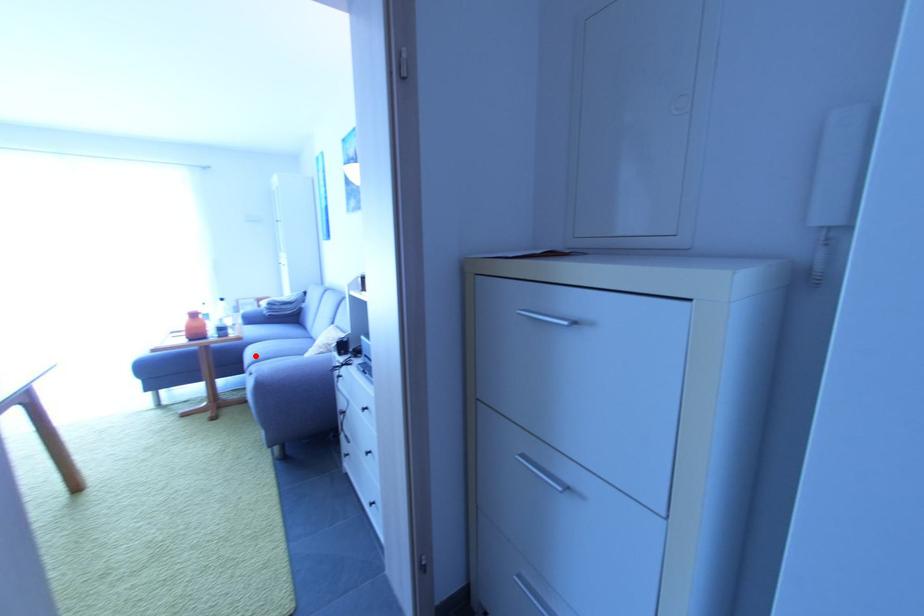
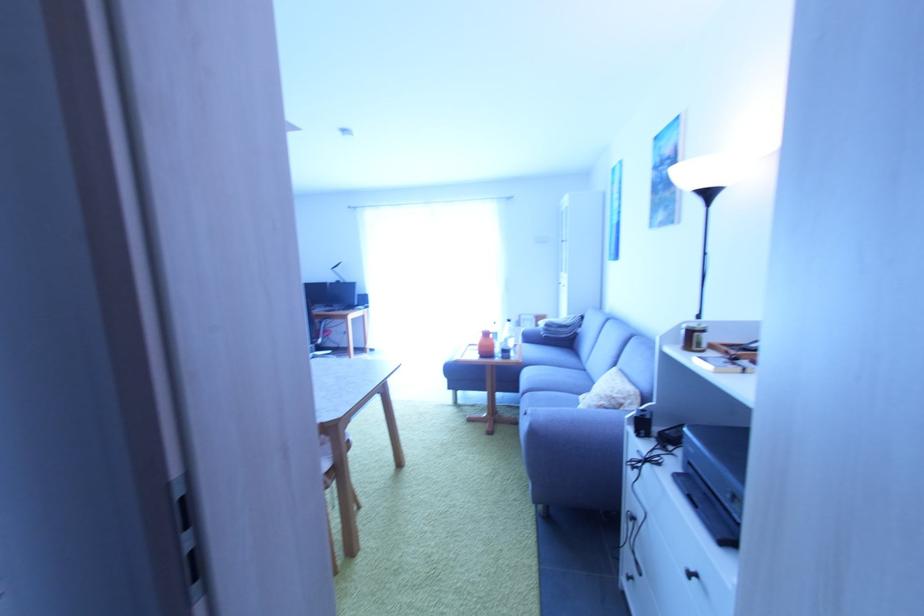
Locate, in the second image, the point that corresponds to the highlighted location in the first image.

(530, 378)